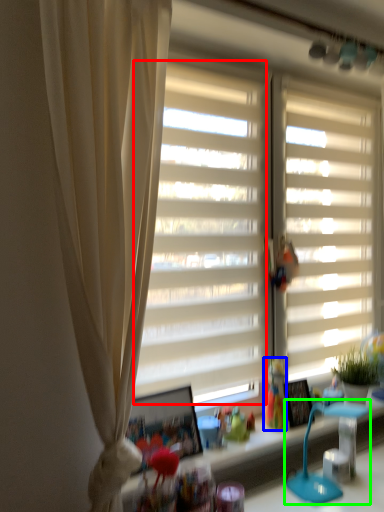
Question: Which object is the closest to the window screen (highlighted by a red box)? Choose among these: toy (highlighted by a blue box) or table lamp (highlighted by a green box).

Choices:
 (A) toy
 (B) table lamp

Answer: (A)